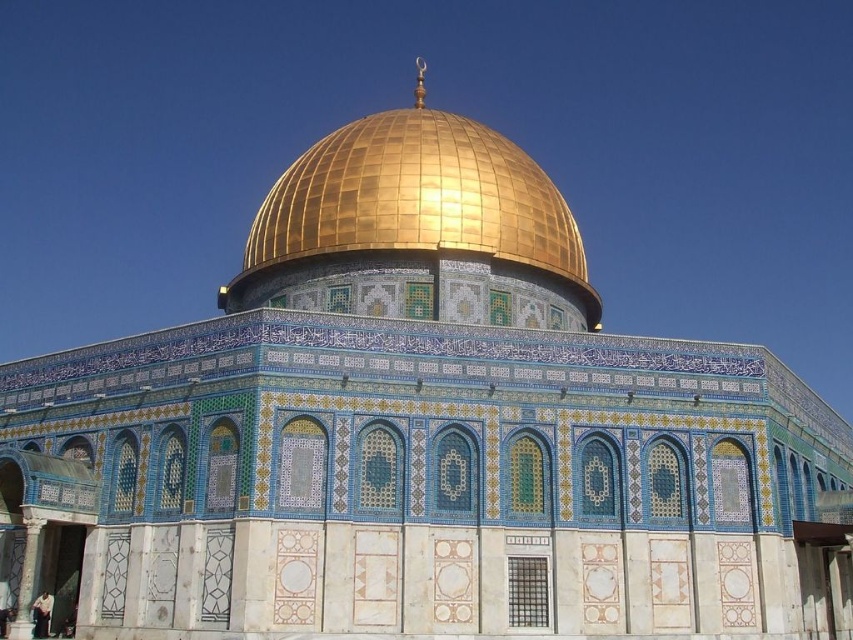
You are an architect visiting the Dome of the Rock and want to compare the sizes of the gold mosaic dome at center and the dark blue fabric at lower left. Which one is bigger?

The gold mosaic dome at center is larger in size than the dark blue fabric at lower left.

You are standing in front of the Dome of the Rock and notice two points marked on the structure. One is at coordinates point (x=256, y=294) and the other at point (x=44, y=609). Which of these points is closer to you?

Point (x=256, y=294) is further to the viewer than point (x=44, y=609), so the point closer to you is point (x=44, y=609).

You are a tourist visiting the Dome of the Rock and want to take a photo that includes both the gold mosaic dome at center and the dark blue fabric at lower left. Based on their sizes, which object should you focus on to ensure both fit in the frame?

The gold mosaic dome at center might be wider than dark blue fabric at lower left, so focusing on the dome would ensure both fit in the frame as it is likely larger.